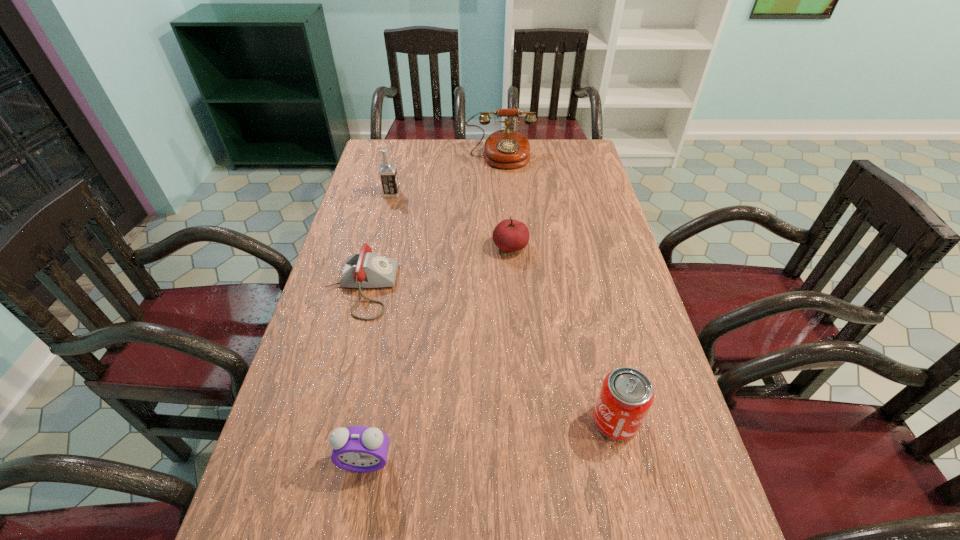
Where is `free space at the far edge of the desktop`? This screenshot has height=540, width=960. free space at the far edge of the desktop is located at coordinates (471, 157).

Identify the location of blank space at the left edge of the desktop. The width and height of the screenshot is (960, 540). (334, 357).

Image resolution: width=960 pixels, height=540 pixels. What are the coordinates of `free space at the right edge of the desktop` in the screenshot? It's located at (631, 307).

The height and width of the screenshot is (540, 960). What are the coordinates of `free space at the far left corner` in the screenshot? It's located at (391, 143).

The width and height of the screenshot is (960, 540). In the image, there is a desktop. What are the coordinates of `free space at the far right corner` in the screenshot? It's located at (568, 163).

This screenshot has width=960, height=540. Identify the location of vacant area that lies between the vodka and the tomato. tap(451, 220).

I want to click on vacant area that lies between the fifth farthest object and the shorter telephone, so click(x=488, y=354).

This screenshot has width=960, height=540. I want to click on vacant space in between the farthest object and the fifth nearest object, so click(446, 176).

Where is `vacant area that lies between the vodka and the can`? The height and width of the screenshot is (540, 960). vacant area that lies between the vodka and the can is located at coordinates (503, 307).

In order to click on free point between the nearest object and the third farthest object in this screenshot , I will do `click(438, 354)`.